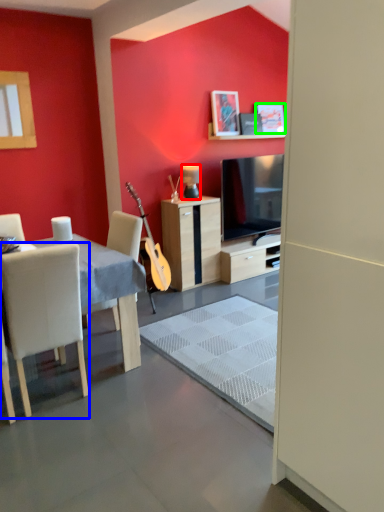
Question: Estimate the real-world distances between objects in this image. Which object is farther from lamp (highlighted by a red box), chair (highlighted by a blue box) or picture frame (highlighted by a green box)?

Choices:
 (A) chair
 (B) picture frame

Answer: (A)